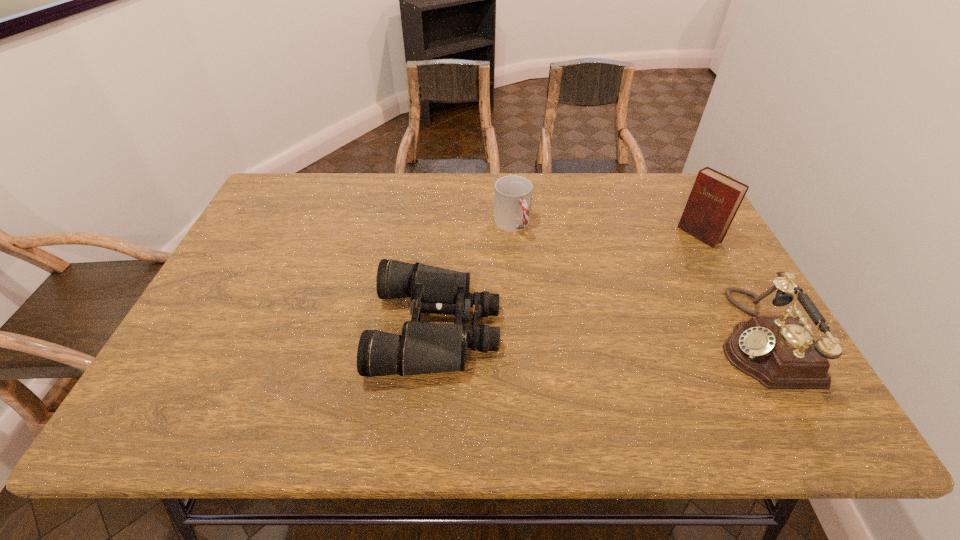
Identify the location of binoculars. This screenshot has height=540, width=960. (423, 348).

Where is `telephone`? This screenshot has height=540, width=960. telephone is located at coordinates (779, 352).

I want to click on the second shortest object, so click(x=513, y=194).

The height and width of the screenshot is (540, 960). I want to click on diary, so click(x=715, y=198).

Identify the location of vacant area located through the eyepieces of the shortest object. Image resolution: width=960 pixels, height=540 pixels. [x=559, y=328].

Identify the location of blank space located 0.340m on the dial of the telephone. (569, 338).

You are a GUI agent. You are given a task and a screenshot of the screen. Output one action in this format:
    pyautogui.click(x=<x>, y=<y>)
    Task: Click on the free spot located on the dial of the telephone
    
    Given the screenshot: What is the action you would take?
    pyautogui.click(x=634, y=338)

Locate an element on the screen. This screenshot has height=540, width=960. vacant region located 0.160m on the dial of the telephone is located at coordinates (647, 338).

Identify the location of vacant space located 0.360m on the handle side of the third tallest object. (583, 334).

The height and width of the screenshot is (540, 960). I want to click on free location located 0.310m on the handle side of the third tallest object, so click(572, 318).